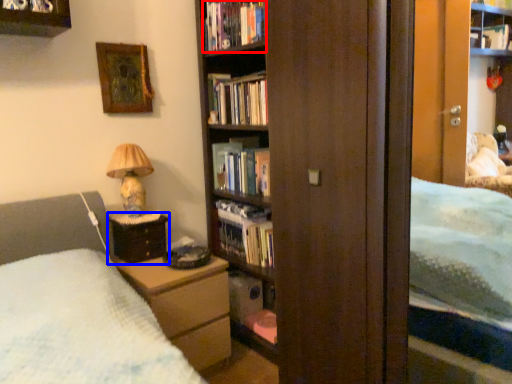
Question: Which point is closer to the camera, book (highlighted by a red box) or nightstand (highlighted by a blue box)?

Choices:
 (A) book
 (B) nightstand

Answer: (B)